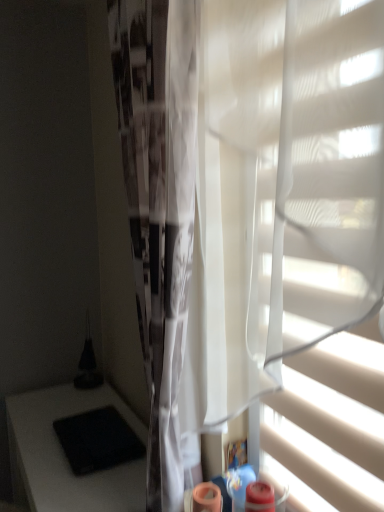
This screenshot has width=384, height=512. Describe the element at coordinates (330, 424) in the screenshot. I see `white matte blind at right` at that location.

You are a GUI agent. You are given a task and a screenshot of the screen. Output one action in this format:
    pyautogui.click(x=<x>, y=<y>)
    Task: Click on the black matte table at lower left
    
    Given the screenshot: What is the action you would take?
    pyautogui.click(x=65, y=456)

What do you see at coordinates (65, 456) in the screenshot? I see `black matte table at lower left` at bounding box center [65, 456].

At what (x,y) coordinates should I click in order to perform the action: click on white sheer fabric at center. Please return your answer as a coordinate pair (x, y). Looking at the image, I should click on (159, 205).

Where is `white matte blind at right`? This screenshot has height=512, width=384. white matte blind at right is located at coordinates (330, 424).

Does black matte pad at lower left have a smaller size compared to black matte table at lower left?

Yes, black matte pad at lower left is smaller than black matte table at lower left.

How far apart are black matte pad at lower left and black matte table at lower left?

The distance of black matte pad at lower left from black matte table at lower left is 4.45 inches.

From the image's perspective, is black matte pad at lower left located above or below black matte table at lower left?

From the image's perspective, black matte pad at lower left appears above black matte table at lower left.

This screenshot has height=512, width=384. I want to click on table that appears below the black matte pad at lower left (from a real-world perspective), so click(65, 456).

Locate an element on the screen. table beneath the white sheer fabric at center (from a real-world perspective) is located at coordinates (65, 456).

Considering the sizes of objects black matte table at lower left and white sheer fabric at center in the image provided, who is smaller, black matte table at lower left or white sheer fabric at center?

white sheer fabric at center is smaller.

From the image's perspective, between black matte table at lower left and white sheer fabric at center, who is located below?

black matte table at lower left appears lower in the image.

From a real-world perspective, between white sheer fabric at center and white matte blind at right, who is vertically lower?

From a 3D spatial view, white matte blind at right is below.

How far apart are white sheer fabric at center and white matte blind at right?

white sheer fabric at center is 17.25 inches from white matte blind at right.

The height and width of the screenshot is (512, 384). I want to click on shower curtain above the white matte blind at right (from a real-world perspective), so click(x=159, y=205).

Could you tell me if white sheer fabric at center is turned towards white matte blind at right?

No, white sheer fabric at center is not aimed at white matte blind at right.

Considering their positions, is black matte table at lower left located in front of or behind black matte pad at lower left?

black matte table at lower left is in front of black matte pad at lower left.

Is black matte table at lower left in contact with black matte pad at lower left?

No, black matte table at lower left is not making contact with black matte pad at lower left.

What's the angular difference between black matte table at lower left and black matte pad at lower left's facing directions?

The facing directions of black matte table at lower left and black matte pad at lower left are 0.15 degrees apart.

In the scene shown: From the image's perspective, does white matte blind at right appear higher than white sheer fabric at center?

No, from the image's perspective, white matte blind at right is not on top of white sheer fabric at center.

Is white matte blind at right to the right of white sheer fabric at center from the viewer's perspective?

Yes.

Find the location of a particular element. This screenshot has width=384, height=512. shower curtain located above the white matte blind at right (from the image's perspective) is located at coordinates (159, 205).

Does white matte blind at right come behind white sheer fabric at center?

No, it is in front of white sheer fabric at center.

Is black matte table at lower left further to camera compared to white matte blind at right?

Yes.

Is black matte table at lower left next to white matte blind at right?

black matte table at lower left and white matte blind at right are clearly separated.

Can you tell me how much black matte table at lower left and white matte blind at right differ in facing direction?

The facing directions of black matte table at lower left and white matte blind at right are 1.06 degrees apart.

Is black matte table at lower left located outside white matte blind at right?

black matte table at lower left is positioned outside white matte blind at right.

Measure the distance from black matte pad at lower left to white sheer fabric at center.

black matte pad at lower left is 57.83 centimeters away from white sheer fabric at center.

Is black matte pad at lower left wider than white sheer fabric at center?

Yes, black matte pad at lower left is wider than white sheer fabric at center.

From a real-world perspective, is black matte pad at lower left on top of white sheer fabric at center?

Actually, black matte pad at lower left is physically below white sheer fabric at center in the real world.

Is black matte pad at lower left not inside white sheer fabric at center?

Indeed, black matte pad at lower left is completely outside white sheer fabric at center.

Find the location of a particular element. This screenshot has width=384, height=512. table below the black matte pad at lower left (from a real-world perspective) is located at coordinates (65, 456).

Find the location of a particular element. Image resolution: width=384 pixels, height=512 pixels. table below the white sheer fabric at center (from the image's perspective) is located at coordinates (65, 456).

Estimate the real-world distances between objects in this image. Which object is further from black matte table at lower left, white sheer fabric at center or white matte blind at right?

The object further to black matte table at lower left is white matte blind at right.

From the image, which object appears to be farther from white sheer fabric at center, white matte blind at right or black matte table at lower left?

black matte table at lower left.

When comparing their distances from black matte table at lower left, does white sheer fabric at center or black matte pad at lower left seem further?

Based on the image, white sheer fabric at center appears to be further to black matte table at lower left.

Estimate the real-world distances between objects in this image. Which object is closer to white matte blind at right, black matte table at lower left or black matte pad at lower left?

black matte pad at lower left is positioned closer to the anchor white matte blind at right.

Based on their spatial positions, is black matte table at lower left or white matte blind at right closer to white sheer fabric at center?

white matte blind at right is closer to white sheer fabric at center.

From the image, which object appears to be nearer to white sheer fabric at center, black matte table at lower left or black matte pad at lower left?

black matte pad at lower left is closer to white sheer fabric at center.

Estimate the real-world distances between objects in this image. Which object is closer to white sheer fabric at center, white matte blind at right or black matte pad at lower left?

The object closer to white sheer fabric at center is white matte blind at right.

Considering their positions, is black matte pad at lower left positioned closer to black matte table at lower left than white matte blind at right?

The object closer to black matte table at lower left is black matte pad at lower left.

You are a GUI agent. You are given a task and a screenshot of the screen. Output one action in this format:
    pyautogui.click(x=<x>, y=<y>)
    Task: Click on the shower curtain between white matte blind at right and black matte pad at lower left in the front-back direction
    The width and height of the screenshot is (384, 512).
    Given the screenshot: What is the action you would take?
    pyautogui.click(x=159, y=205)

This screenshot has width=384, height=512. I want to click on blind that lies between white sheer fabric at center and black matte table at lower left from top to bottom, so click(330, 424).

Locate an element on the screen. pad between white sheer fabric at center and black matte table at lower left in the vertical direction is located at coordinates (98, 440).

At what (x,y) coordinates should I click in order to perform the action: click on pad between black matte table at lower left and white matte blind at right. Please return your answer as a coordinate pair (x, y). The height and width of the screenshot is (512, 384). Looking at the image, I should click on (98, 440).